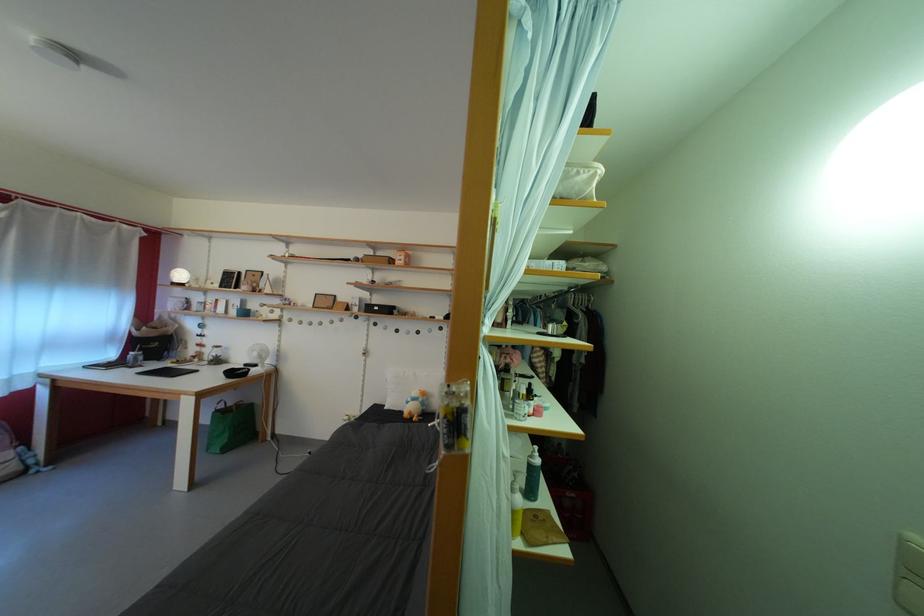
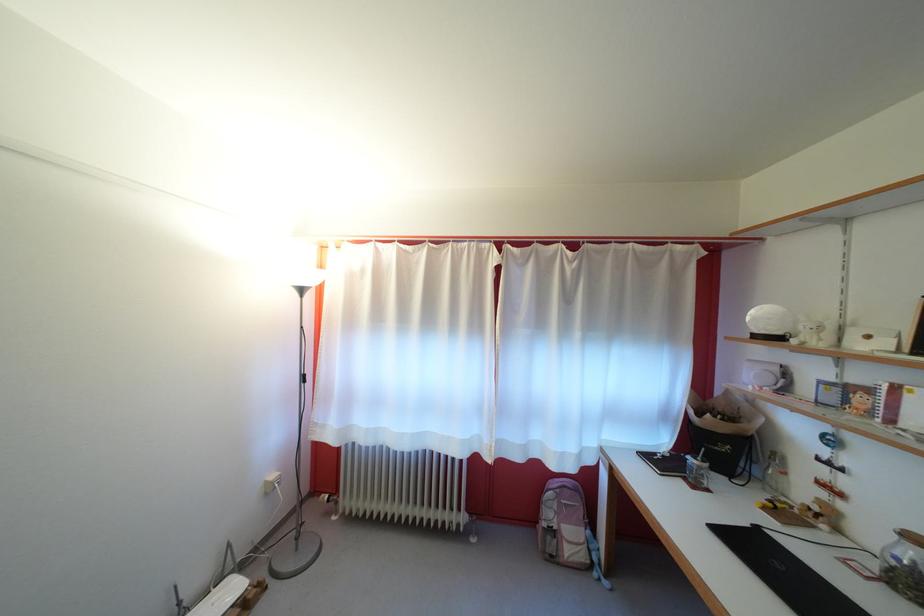
The point at (144, 362) is marked in the first image. Where is the corresponding point in the second image?

(708, 474)